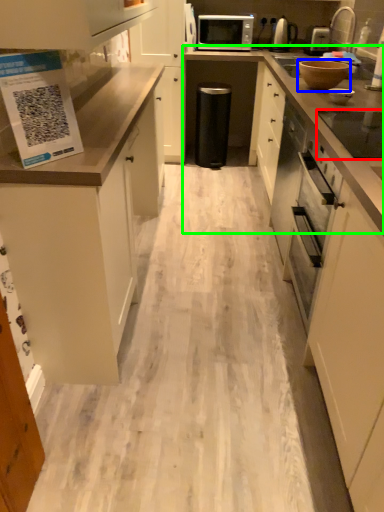
Question: Estimate the real-world distances between objects in this image. Which object is farther from appliance (highlighted by a red box), appliance (highlighted by a blue box) or countertop (highlighted by a green box)?

Choices:
 (A) appliance
 (B) countertop

Answer: (A)